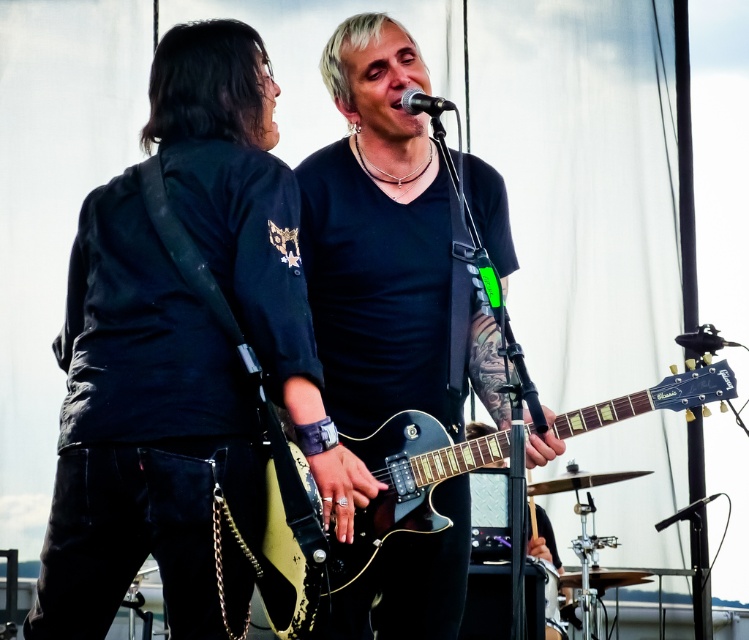
Between glossy black electric guitar at center and black metallic microphone at center, which one has less height?

black metallic microphone at center

In the scene shown: Can you confirm if glossy black electric guitar at center is smaller than black metallic microphone at center?

No, glossy black electric guitar at center is not smaller than black metallic microphone at center.

This screenshot has width=749, height=640. What are the coordinates of `glossy black electric guitar at center` in the screenshot? It's located at (407, 477).

Does matte black guitar at left appear over black metallic microphone at center?

Actually, matte black guitar at left is below black metallic microphone at center.

Who is positioned more to the right, matte black guitar at left or black metallic microphone at center?

Positioned to the right is black metallic microphone at center.

What do you see at coordinates (145, 436) in the screenshot?
I see `matte black guitar at left` at bounding box center [145, 436].

I want to click on matte black guitar at left, so click(145, 436).

Is matte black guitar at left taller than matte black guitar at center?

No.

Which is in front, point (72, 326) or point (419, 595)?

Point (72, 326) is more forward.

Locate an element on the screen. matte black guitar at left is located at coordinates (145, 436).